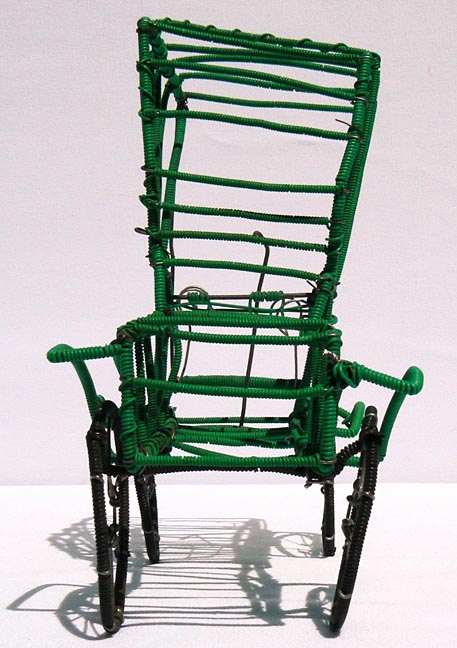
Locate an element on the screen. The height and width of the screenshot is (648, 457). white floor of left corner of image is located at coordinates (11, 632).